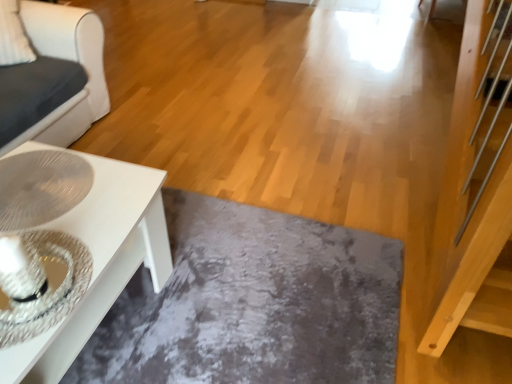
Locate an element on the screen. This screenshot has width=512, height=384. free location to the right of white glossy coffee table at lower left is located at coordinates (178, 129).